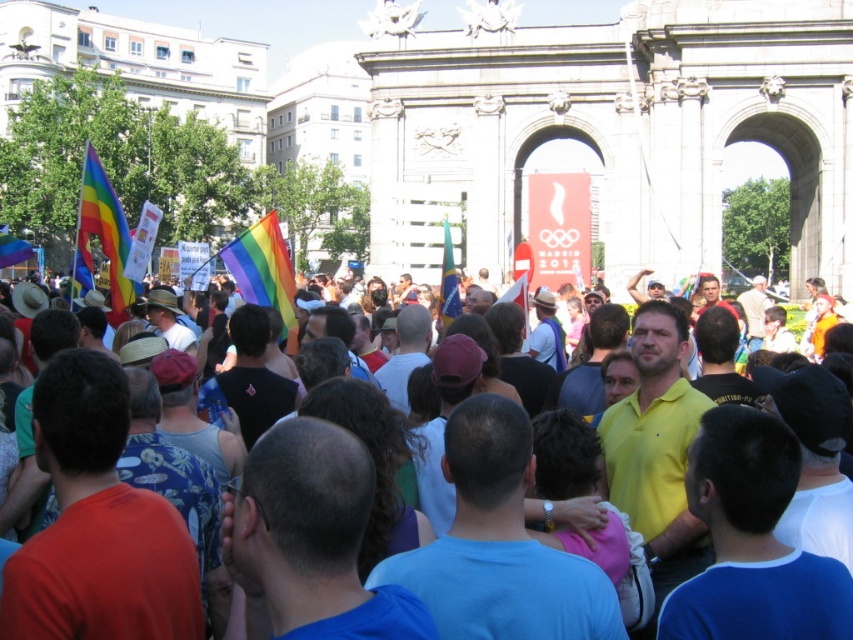
You are an event organizer trying to identify key elements in the crowd for a promotional photo. Which object among the matte yellow shirt at center and the rainbow fabric flag at upper left is bigger in size?

The matte yellow shirt at center has a larger size compared to the rainbow fabric flag at upper left, so the matte yellow shirt at center is bigger in size.

You are a photographer at the event and want to capture both the matte yellow shirt at center and the blue fabric flag at center in a single frame. Given their sizes, which object should you focus on to ensure both are clearly visible?

Since the matte yellow shirt at center is larger than the blue fabric flag at center, you should focus on the matte yellow shirt at center to ensure both objects are clearly visible in the frame.